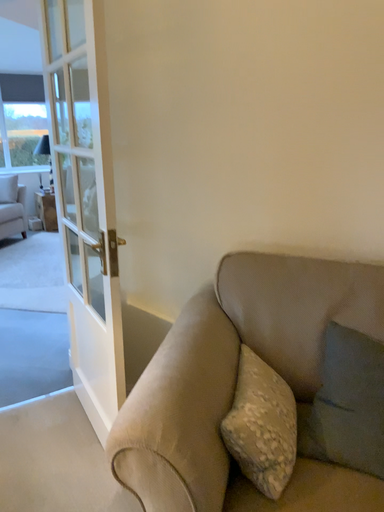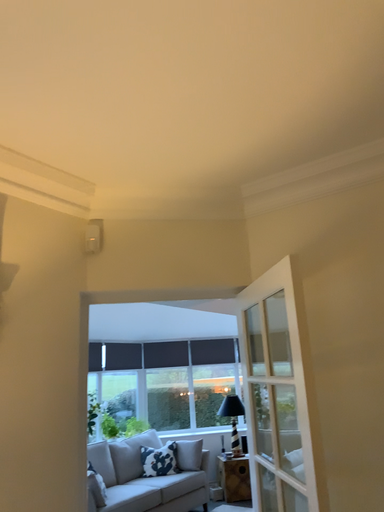
Question: How did the camera likely rotate when shooting the video?

Choices:
 (A) rotated left
 (B) rotated right

Answer: (A)